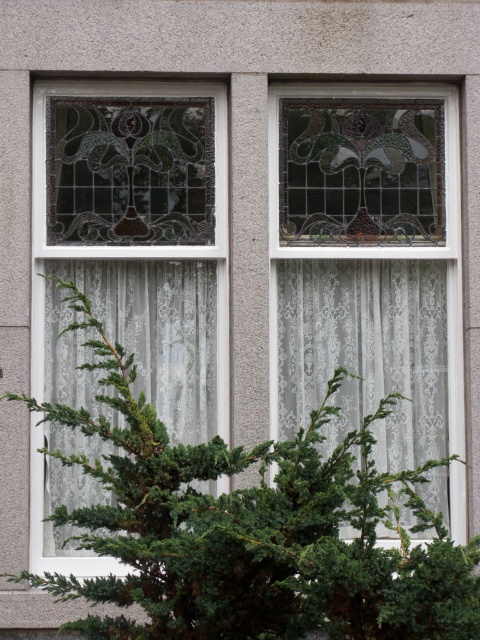
Which of these two, green leafy bush at center or white lace curtain at center, stands shorter?

Standing shorter between the two is green leafy bush at center.

Which is above, green leafy bush at center or white lace curtain at center?

white lace curtain at center is above.

Does point (96, 625) lie in front of point (359, 276)?

Yes, point (96, 625) is in front of point (359, 276).

Identify the location of green leafy bush at center. This screenshot has height=640, width=480. (251, 529).

Between point (278, 550) and point (48, 548), which one is positioned behind?

Point (48, 548)

Is green leafy bush at center wider than white lace curtain at left?

Correct, the width of green leafy bush at center exceeds that of white lace curtain at left.

Between point (122, 451) and point (173, 438), which one is positioned in front?

Positioned in front is point (122, 451).

Image resolution: width=480 pixels, height=640 pixels. I want to click on green leafy bush at center, so click(x=251, y=529).

Is white lace curtain at center bigger than white lace curtain at left?

No, white lace curtain at center is not bigger than white lace curtain at left.

Can you confirm if white lace curtain at center is wider than white lace curtain at left?

Yes.

Is point (316, 298) closer to viewer compared to point (168, 374)?

No, (316, 298) is further to viewer.

Find the location of a particular element. white lace curtain at center is located at coordinates (365, 349).